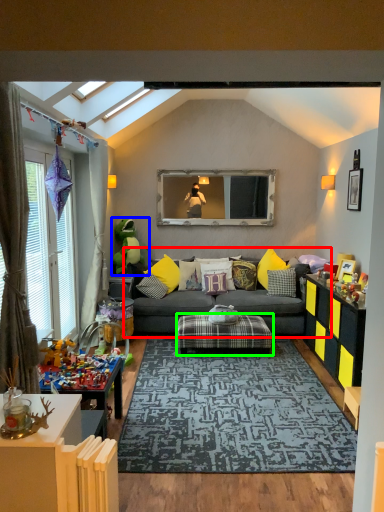
Question: Which object is positioned closest to studio couch (highlighted by a red box)? Select from toy (highlighted by a blue box) and table (highlighted by a green box).

Choices:
 (A) toy
 (B) table

Answer: (B)